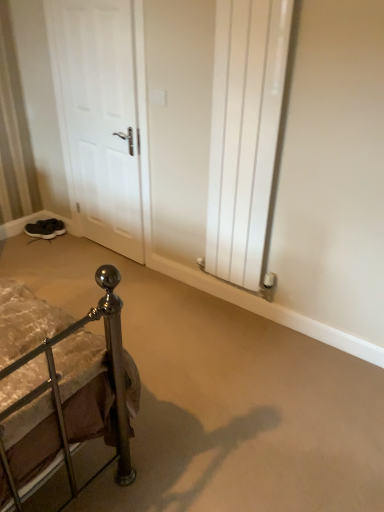
Where is `vacant space in front of dark gray suede sneakers at lower left, which appears as the 2th footwear when viewed from the back`? vacant space in front of dark gray suede sneakers at lower left, which appears as the 2th footwear when viewed from the back is located at coordinates (38, 243).